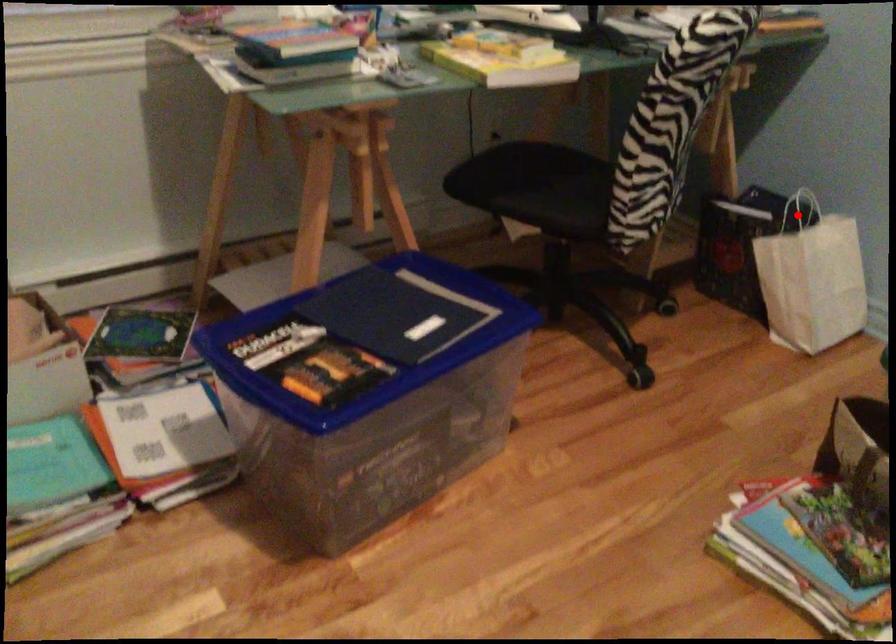
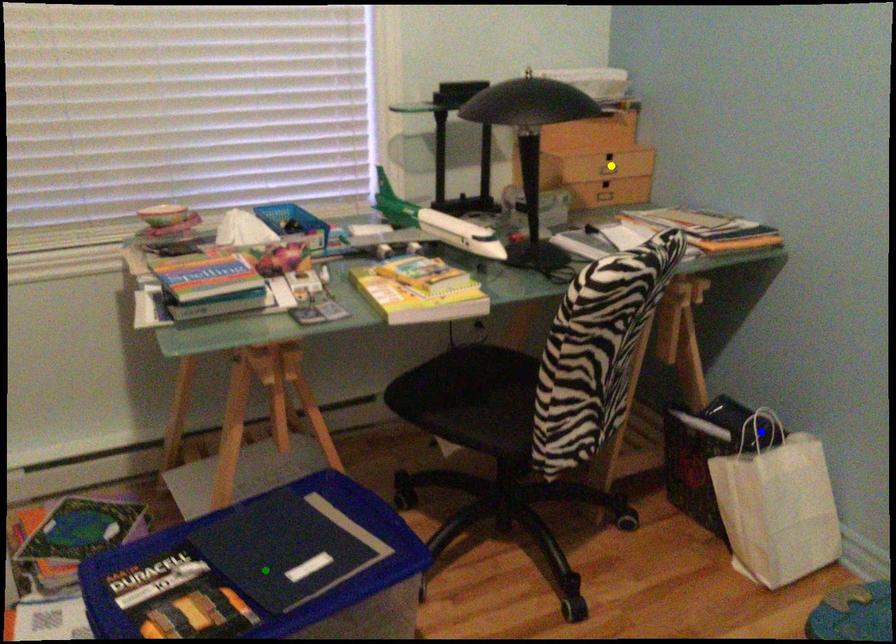
Question: I am providing you with two images of the same scene from different viewpoints. A red point is marked on the first image. You are given multiple points on the second image. Which spot in image 2 lines up with the point in image 1?

Choices:
 (A) yellow point
 (B) blue point
 (C) green point

Answer: (B)